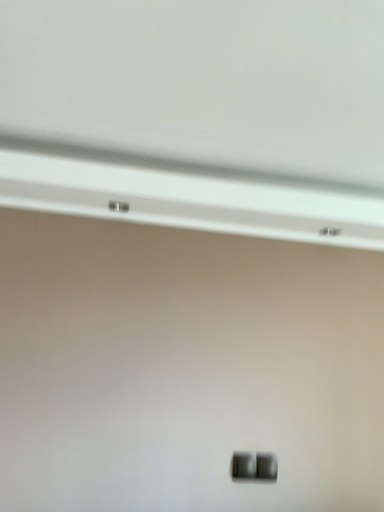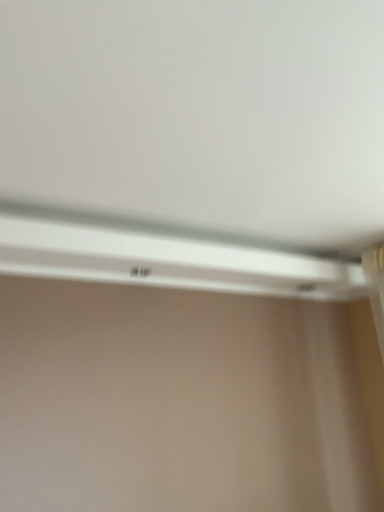
Question: How did the camera likely rotate when shooting the video?

Choices:
 (A) rotated right
 (B) rotated left

Answer: (A)